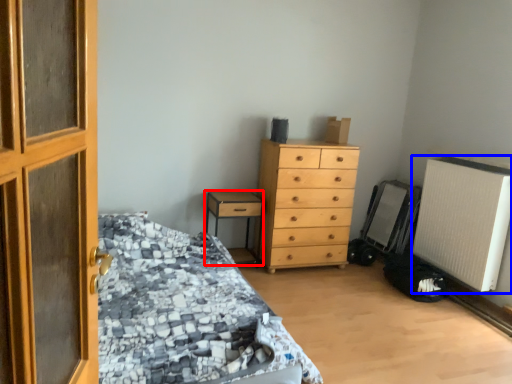
Question: Among these objects, which one is farthest to the camera, nightstand (highlighted by a red box) or air conditioning (highlighted by a blue box)?

Choices:
 (A) nightstand
 (B) air conditioning

Answer: (A)